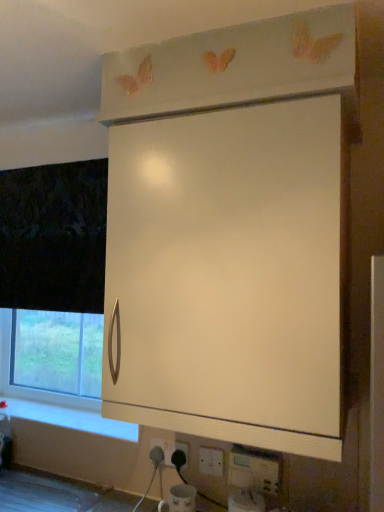
Question: Should I look upward or downward to see white matte cabinet at upper center?

Choices:
 (A) up
 (B) down

Answer: (B)

Question: Is white matte cabinet at upper center at the right side of white plastic electric outlet at lower center, placed as the third electric outlet when sorted from back to front?

Choices:
 (A) yes
 (B) no

Answer: (B)

Question: From a real-world perspective, is white matte cabinet at upper center positioned over white plastic electric outlet at lower center, which is counted as the third electric outlet, starting from the left, based on gravity?

Choices:
 (A) no
 (B) yes

Answer: (B)

Question: Does white matte cabinet at upper center have a lesser height compared to white plastic electric outlet at lower center, which is counted as the third electric outlet, starting from the left?

Choices:
 (A) yes
 (B) no

Answer: (B)

Question: Considering the relative sizes of white matte cabinet at upper center and white plastic electric outlet at lower center, placed as the first electric outlet when sorted from right to left, in the image provided, is white matte cabinet at upper center wider than white plastic electric outlet at lower center, placed as the first electric outlet when sorted from right to left,?

Choices:
 (A) yes
 (B) no

Answer: (A)

Question: From the image's perspective, is white matte cabinet at upper center above white plastic electric outlet at lower center, which is counted as the third electric outlet, starting from the left?

Choices:
 (A) yes
 (B) no

Answer: (A)

Question: Can you confirm if white matte cabinet at upper center is thinner than white plastic electric outlet at lower center, marked as the 1th electric outlet in a front-to-back arrangement?

Choices:
 (A) yes
 (B) no

Answer: (B)

Question: Can you confirm if white plastic electric outlet at lower center, marked as the 1th electric outlet in a front-to-back arrangement, is bigger than white plastic electric outlet at lower center, the second electric outlet in the front-to-back sequence?

Choices:
 (A) yes
 (B) no

Answer: (A)

Question: From a real-world perspective, is white plastic electric outlet at lower center, marked as the 1th electric outlet in a front-to-back arrangement, positioned under white plastic electric outlet at lower center, positioned as the 2th electric outlet in left-to-right order, based on gravity?

Choices:
 (A) no
 (B) yes

Answer: (A)

Question: Does white plastic electric outlet at lower center, placed as the first electric outlet when sorted from right to left, lie in front of white plastic electric outlet at lower center, the 2th electric outlet in the right-to-left sequence?

Choices:
 (A) yes
 (B) no

Answer: (A)

Question: Is white plastic electric outlet at lower center, placed as the third electric outlet when sorted from back to front, aimed at white plastic electric outlet at lower center, the second electric outlet when ordered from back to front?

Choices:
 (A) no
 (B) yes

Answer: (A)

Question: Considering the relative sizes of white plastic electric outlet at lower center, placed as the third electric outlet when sorted from back to front, and white plastic electric outlet at lower center, the 2th electric outlet in the right-to-left sequence, in the image provided, is white plastic electric outlet at lower center, placed as the third electric outlet when sorted from back to front, taller than white plastic electric outlet at lower center, the 2th electric outlet in the right-to-left sequence,?

Choices:
 (A) yes
 (B) no

Answer: (A)

Question: Is white plastic electric outlet at lower center, which is counted as the third electric outlet, starting from the left, facing away from white plastic electric outlet at lower center, positioned as the 2th electric outlet in left-to-right order?

Choices:
 (A) yes
 (B) no

Answer: (B)

Question: Could you tell me if white plastic electric outlet at lower center, arranged as the first electric outlet when viewed from the back, is turned towards white matte cabinet at upper center?

Choices:
 (A) yes
 (B) no

Answer: (B)